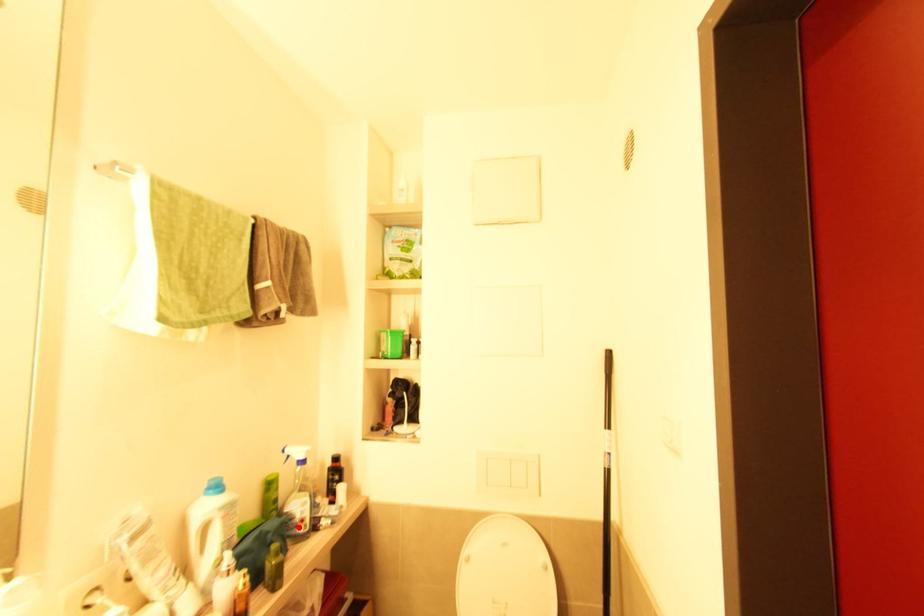
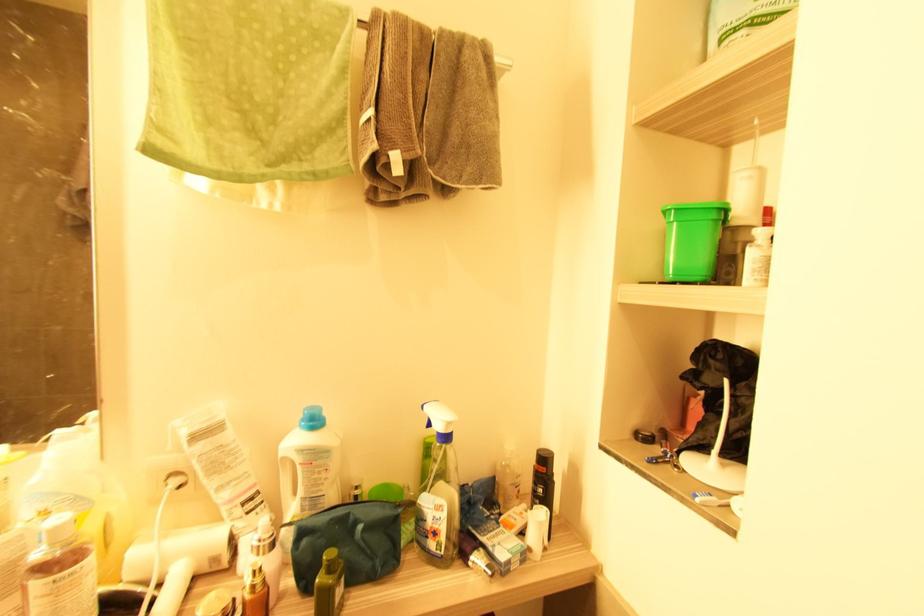
Locate, in the second image, the point that corresponds to the highlighted location in the first image.

(429, 539)